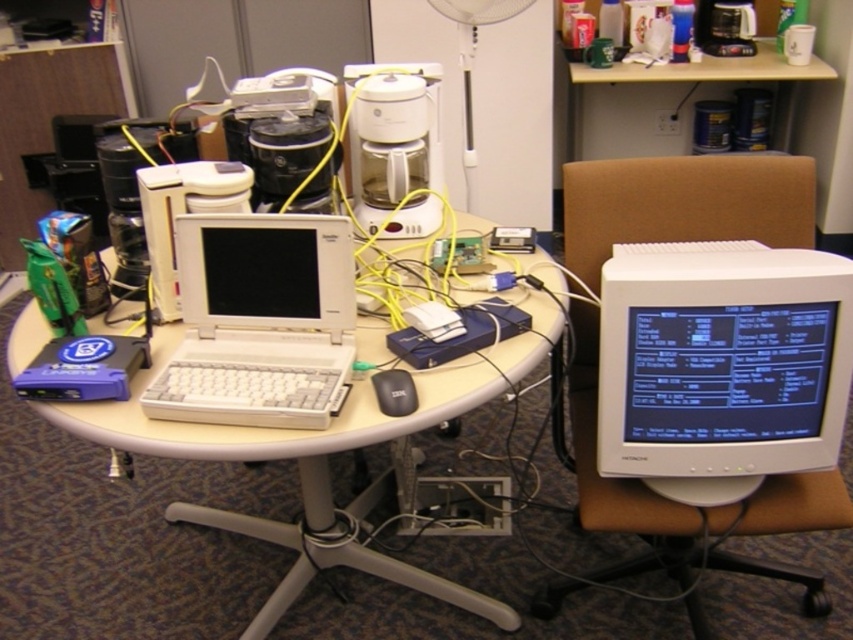
Question: Is white plastic table at center to the right of white plastic desktop computer at center from the viewer's perspective?

Choices:
 (A) yes
 (B) no

Answer: (A)

Question: Which object is farther from the camera taking this photo?

Choices:
 (A) white plastic table at center
 (B) brown leather swivel chair at right

Answer: (B)

Question: Which object appears farthest from the camera in this image?

Choices:
 (A) white plastic monitor at center
 (B) white plastic laptop at center
 (C) white plastic desktop computer at center
 (D) black matte mouse at center

Answer: (C)

Question: Is white plastic monitor at center to the right of black matte mouse at center from the viewer's perspective?

Choices:
 (A) yes
 (B) no

Answer: (B)

Question: Estimate the real-world distances between objects in this image. Which object is farther from the white plastic monitor at center?

Choices:
 (A) brown leather swivel chair at right
 (B) white plastic monitor at center right

Answer: (A)

Question: Considering the relative positions of white plastic monitor at center right and white plastic monitor at center in the image provided, where is white plastic monitor at center right located with respect to white plastic monitor at center?

Choices:
 (A) below
 (B) above

Answer: (A)